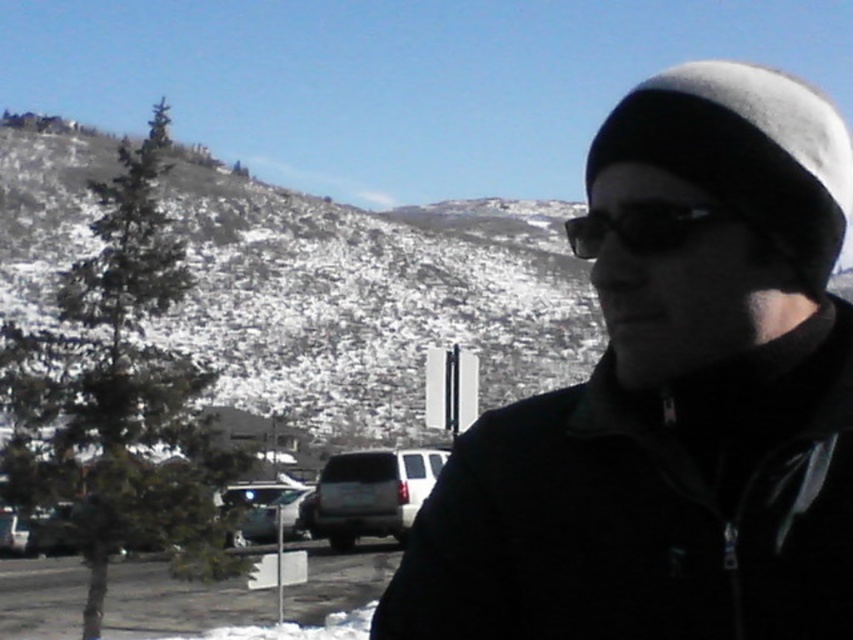
Is snowy textured hillside at upper left smaller than metallic silver sedan at lower left?

No.

This screenshot has width=853, height=640. Describe the element at coordinates (370, 300) in the screenshot. I see `snowy textured hillside at upper left` at that location.

Where is `snowy textured hillside at upper left`? snowy textured hillside at upper left is located at coordinates (370, 300).

Who is positioned more to the right, black matte jacket at center or snowy textured hillside at upper left?

From the viewer's perspective, black matte jacket at center appears more on the right side.

Looking at this image, is black matte jacket at center wider than snowy textured hillside at upper left?

No, black matte jacket at center is not wider than snowy textured hillside at upper left.

Is point (759, 289) in front of point (289, 337)?

Yes, point (759, 289) is closer to viewer.

Where is `black matte jacket at center`? The width and height of the screenshot is (853, 640). black matte jacket at center is located at coordinates (672, 404).

Can you confirm if snowy textured hillside at upper left is positioned to the left of silver metallic suv at center?

Yes, snowy textured hillside at upper left is to the left of silver metallic suv at center.

In the scene shown: Between snowy textured hillside at upper left and silver metallic suv at center, which one is positioned higher?

snowy textured hillside at upper left is higher up.

At what (x,y) coordinates should I click in order to perform the action: click on snowy textured hillside at upper left. Please return your answer as a coordinate pair (x, y). The image size is (853, 640). Looking at the image, I should click on 370,300.